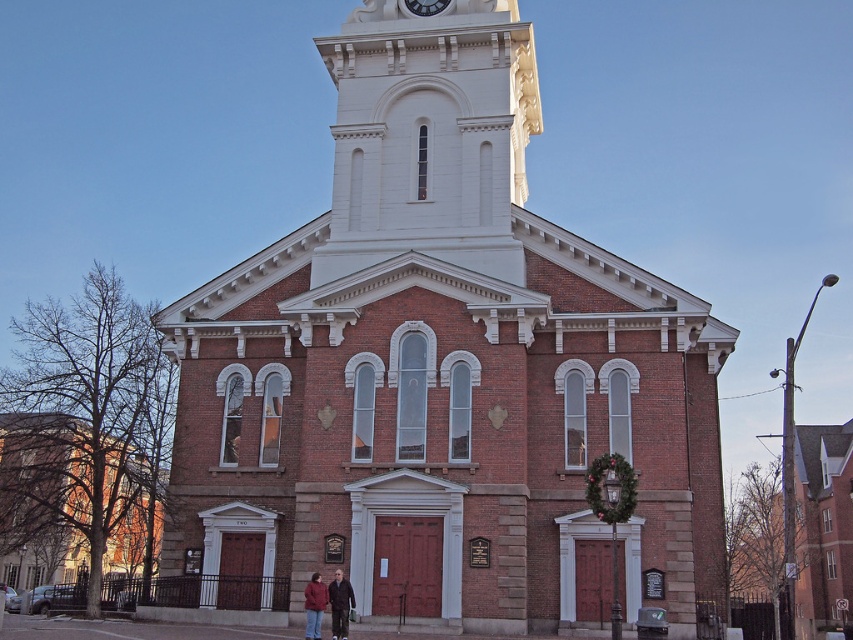
Between brown brick church at left and white glossy clock at upper center, which one is positioned higher?

white glossy clock at upper center is higher up.

Between point (45, 554) and point (415, 13), which one is positioned in front?

Positioned in front is point (415, 13).

Where is `brown brick church at left`? This screenshot has height=640, width=853. brown brick church at left is located at coordinates (73, 492).

Where is `brown brick church at left`? brown brick church at left is located at coordinates point(73,492).

Does white stone clock tower at upper center appear on the right side of brown brick church at left?

Indeed, white stone clock tower at upper center is positioned on the right side of brown brick church at left.

Is white stone clock tower at upper center further to the viewer compared to brown brick church at left?

No, it is not.

Which is in front, point (519, 148) or point (122, 525)?

Point (519, 148) is in front.

Locate an element on the screen. white stone clock tower at upper center is located at coordinates (428, 134).

Does brick church at center have a lesser height compared to matte brown jacket at center?

No, brick church at center is not shorter than matte brown jacket at center.

Who is more forward, (337, 177) or (341, 616)?

Point (341, 616) is in front.

The height and width of the screenshot is (640, 853). What do you see at coordinates (444, 365) in the screenshot?
I see `brick church at center` at bounding box center [444, 365].

Locate an element on the screen. The width and height of the screenshot is (853, 640). brick church at center is located at coordinates (444, 365).